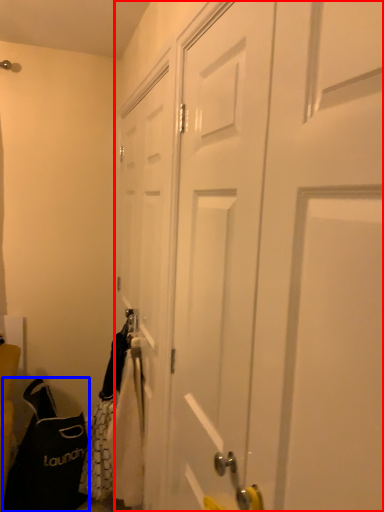
Question: Which of the following is the farthest to the observer, door (highlighted by a red box) or shoulder bag (highlighted by a blue box)?

Choices:
 (A) door
 (B) shoulder bag

Answer: (B)